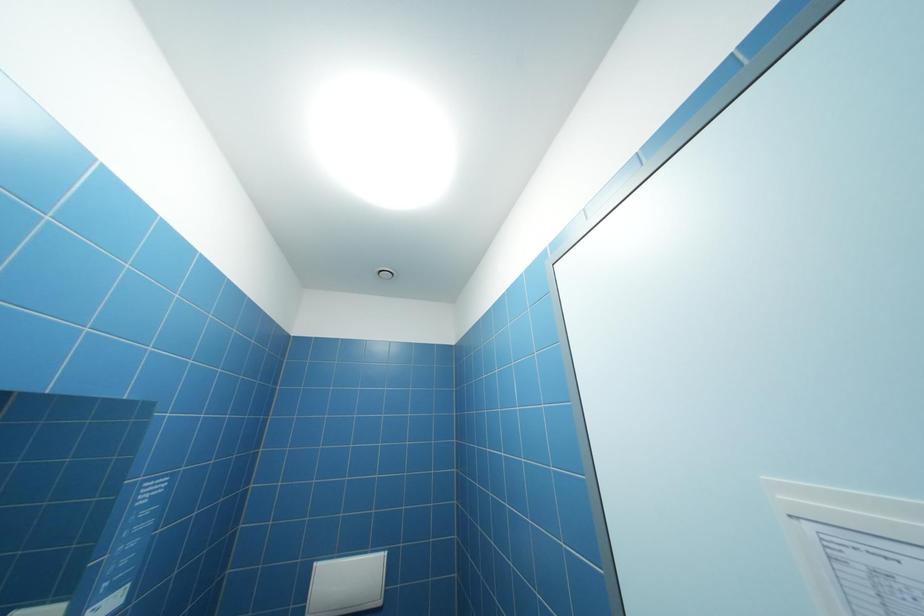
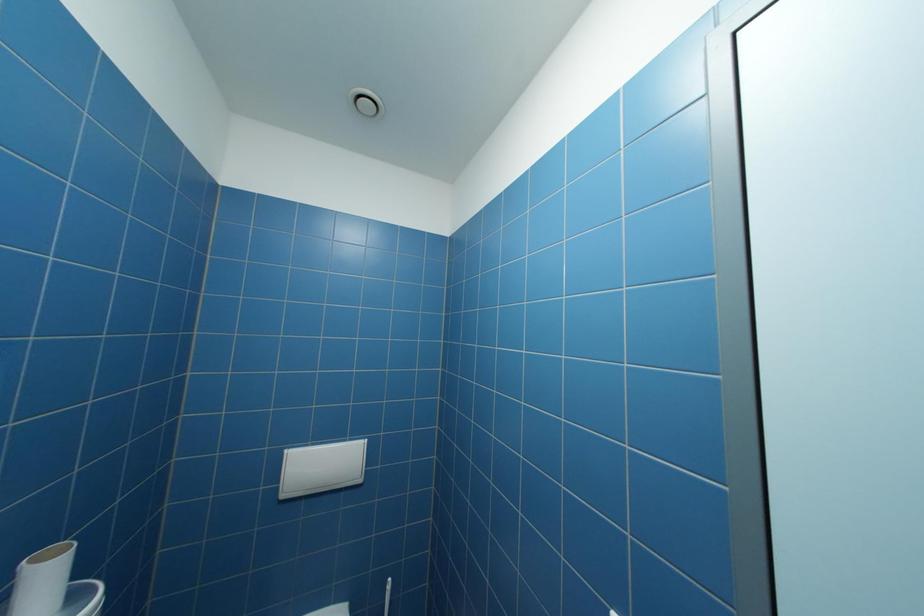
Question: The images are taken continuously from a first-person perspective. In which direction is your viewpoint rotating?

Choices:
 (A) Left
 (B) Right
 (C) Up
 (D) Down

Answer: (D)